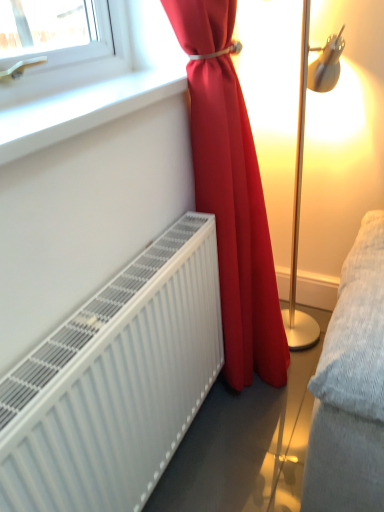
Question: Considering the relative positions of white matte radiator at lower left and white smooth window sill at upper left in the image provided, is white matte radiator at lower left in front of white smooth window sill at upper left?

Choices:
 (A) yes
 (B) no

Answer: (A)

Question: Is white matte radiator at lower left positioned with its back to white smooth window sill at upper left?

Choices:
 (A) no
 (B) yes

Answer: (A)

Question: Considering the relative sizes of white matte radiator at lower left and white smooth window sill at upper left in the image provided, is white matte radiator at lower left shorter than white smooth window sill at upper left?

Choices:
 (A) no
 (B) yes

Answer: (A)

Question: Can you confirm if white matte radiator at lower left is positioned to the left of white smooth window sill at upper left?

Choices:
 (A) yes
 (B) no

Answer: (B)

Question: Is white matte radiator at lower left taller than white smooth window sill at upper left?

Choices:
 (A) yes
 (B) no

Answer: (A)

Question: Can you confirm if white matte radiator at lower left is bigger than white smooth window sill at upper left?

Choices:
 (A) yes
 (B) no

Answer: (A)

Question: From a real-world perspective, is white smooth window sill at upper left positioned under white matte radiator at lower left based on gravity?

Choices:
 (A) no
 (B) yes

Answer: (A)

Question: Is white smooth window sill at upper left oriented away from white matte radiator at lower left?

Choices:
 (A) no
 (B) yes

Answer: (A)

Question: Is white smooth window sill at upper left closer to the viewer compared to white matte radiator at lower left?

Choices:
 (A) no
 (B) yes

Answer: (A)

Question: From the image's perspective, does white smooth window sill at upper left appear higher than white matte radiator at lower left?

Choices:
 (A) no
 (B) yes

Answer: (B)

Question: Is white smooth window sill at upper left next to white matte radiator at lower left and touching it?

Choices:
 (A) no
 (B) yes

Answer: (A)

Question: Is white smooth window sill at upper left at the left side of white matte radiator at lower left?

Choices:
 (A) no
 (B) yes

Answer: (B)

Question: Is matte red curtain at center positioned behind white matte radiator at lower left?

Choices:
 (A) no
 (B) yes

Answer: (B)